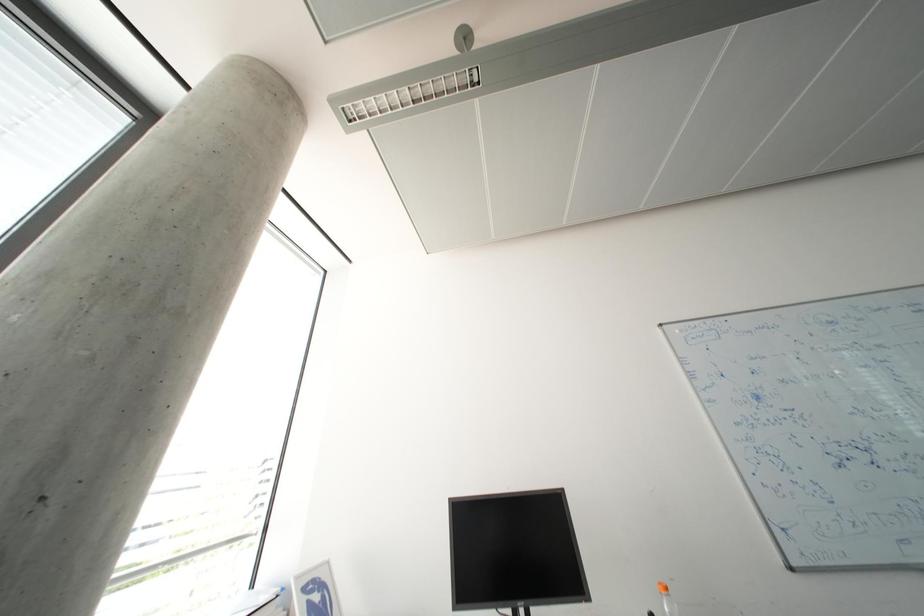
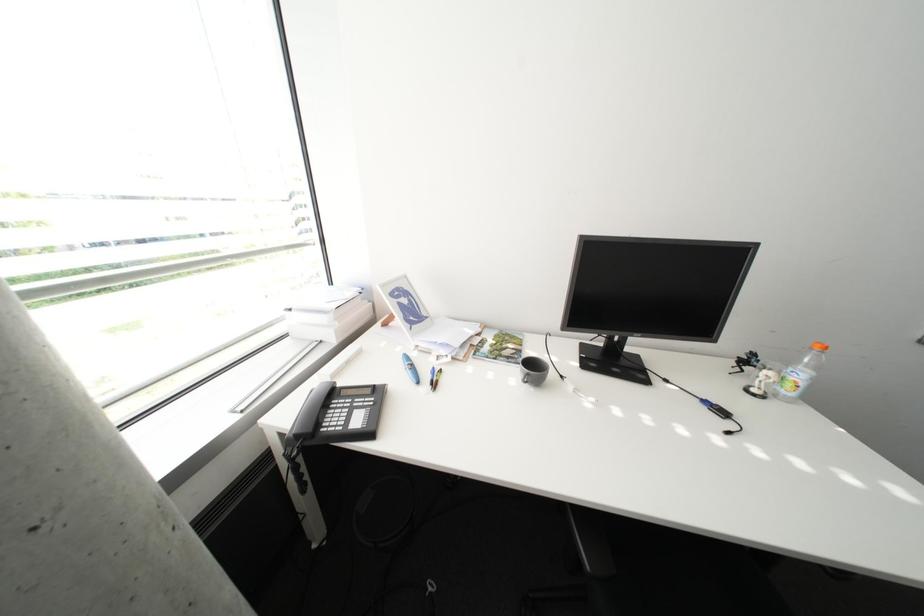
Question: Based on the continuous images, in which direction is the camera rotating? Reply with the corresponding letter.

Choices:
 (A) Left
 (B) Right
 (C) Up
 (D) Down

Answer: (D)